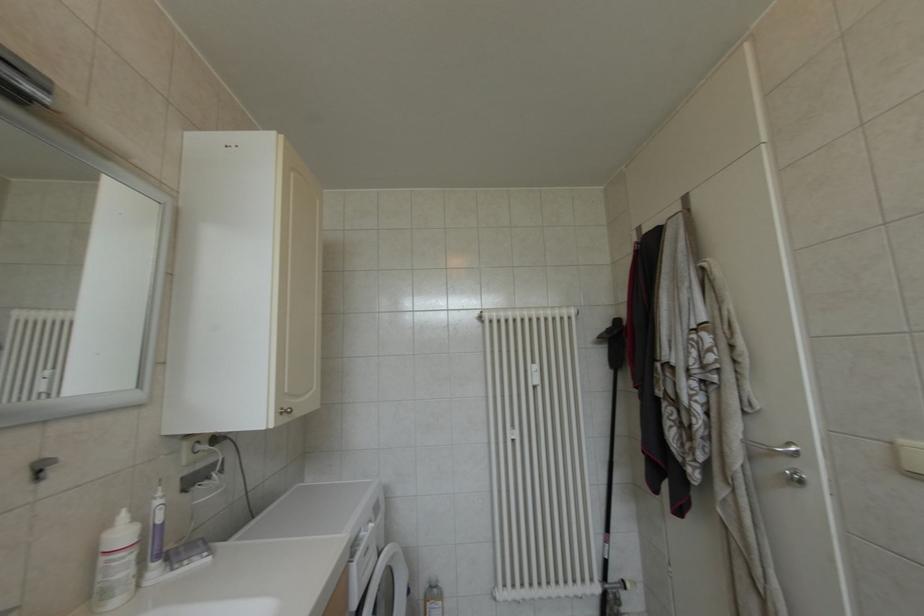
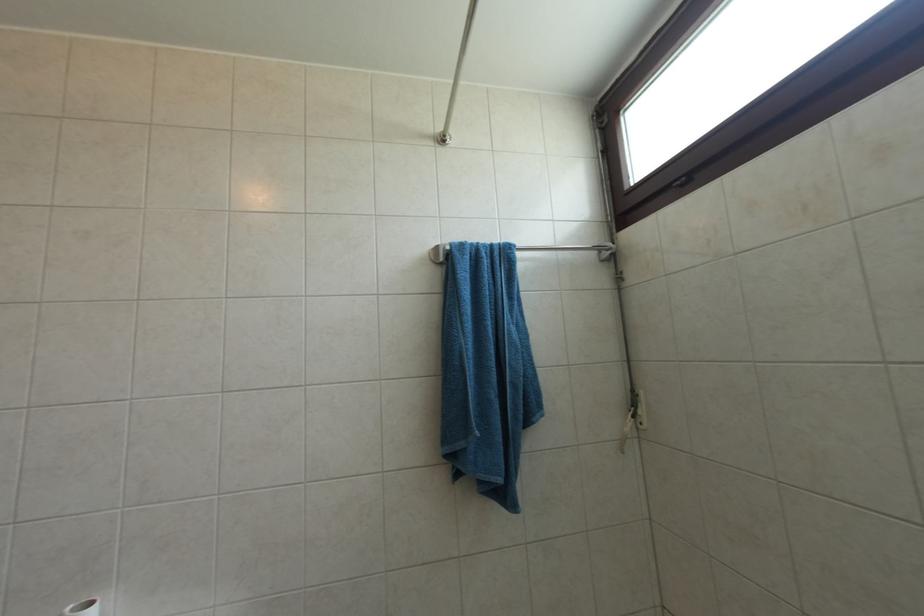
Question: The first image is from the beginning of the video and the second image is from the end. How did the camera likely rotate when shooting the video?

Choices:
 (A) Left
 (B) Right
 (C) Up
 (D) Down

Answer: (B)